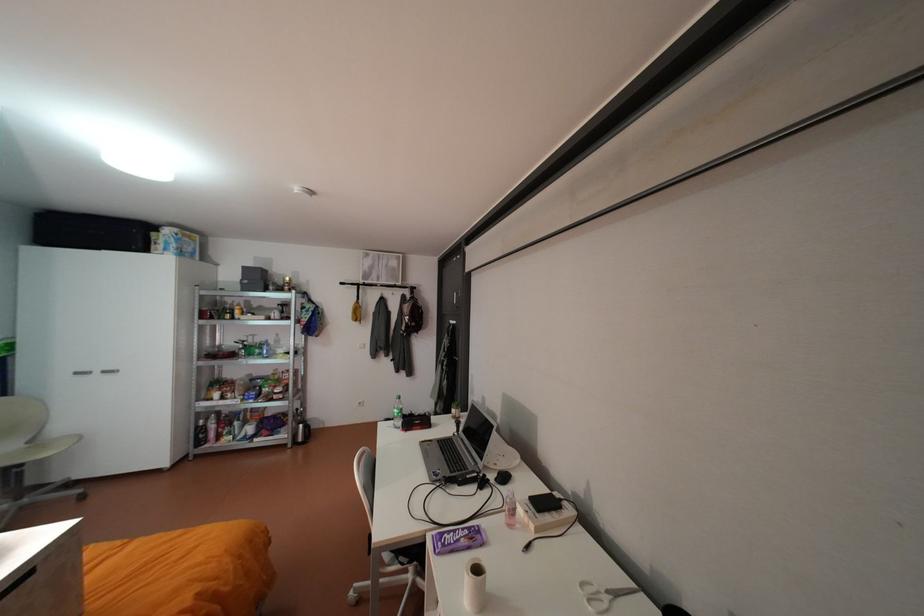
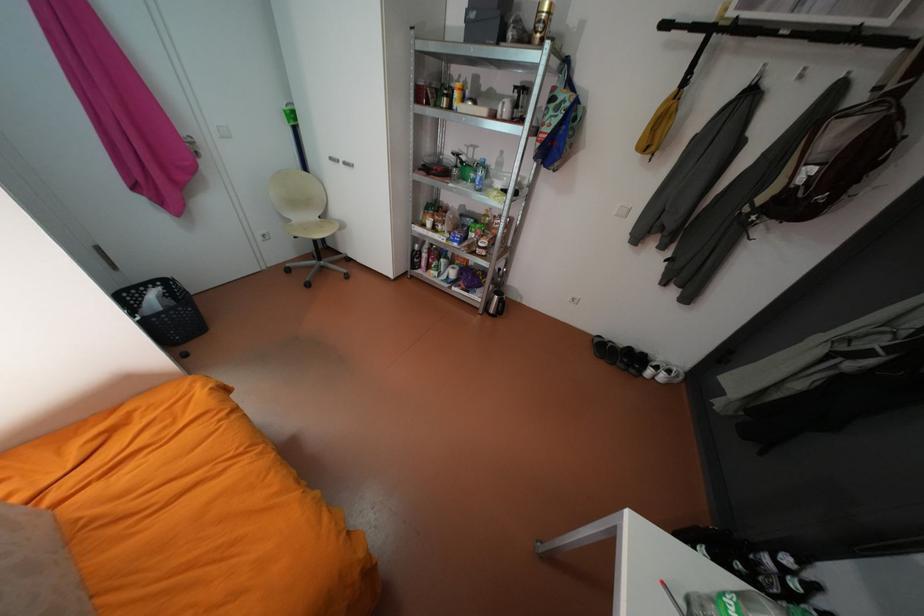
Where in the second image is the point corresponding to point 209,440 from the first image?

(423, 265)